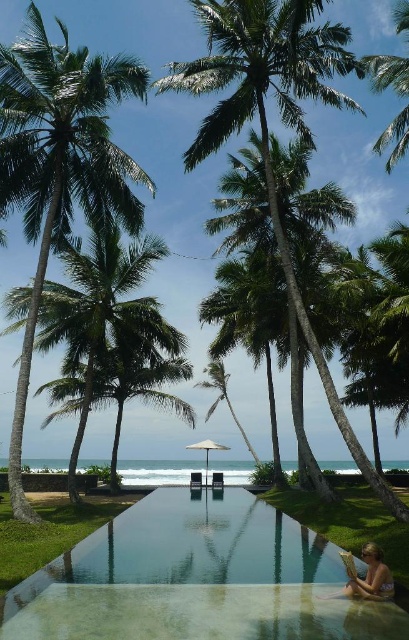
Which is more to the left, green leafy palm tree at upper center or tan skin person at lower right?

tan skin person at lower right is more to the left.

Is green leafy palm tree at upper center taller than tan skin person at lower right?

Yes, green leafy palm tree at upper center is taller than tan skin person at lower right.

Is point (382, 132) more distant than point (375, 580)?

Yes, it is behind point (375, 580).

Image resolution: width=409 pixels, height=640 pixels. In order to click on green leafy palm tree at upper center in this screenshot , I will do `click(397, 96)`.

Who is more distant from viewer, (x=321, y=605) or (x=56, y=193)?

Point (x=56, y=193)

You are a GUI agent. You are given a task and a screenshot of the screen. Output one action in this format:
    pyautogui.click(x=<x>, y=<y>)
    Task: Click on the clear glass pool at center
    The height and width of the screenshot is (640, 409).
    Given the screenshot: What is the action you would take?
    pyautogui.click(x=197, y=579)

Which is above, green leafy palm tree at center or tan skin person at lower right?

Positioned higher is green leafy palm tree at center.

Which is in front, point (309, 3) or point (384, 595)?

Point (384, 595) is more forward.

Identify the location of green leafy palm tree at center. This screenshot has width=409, height=640. (265, 108).